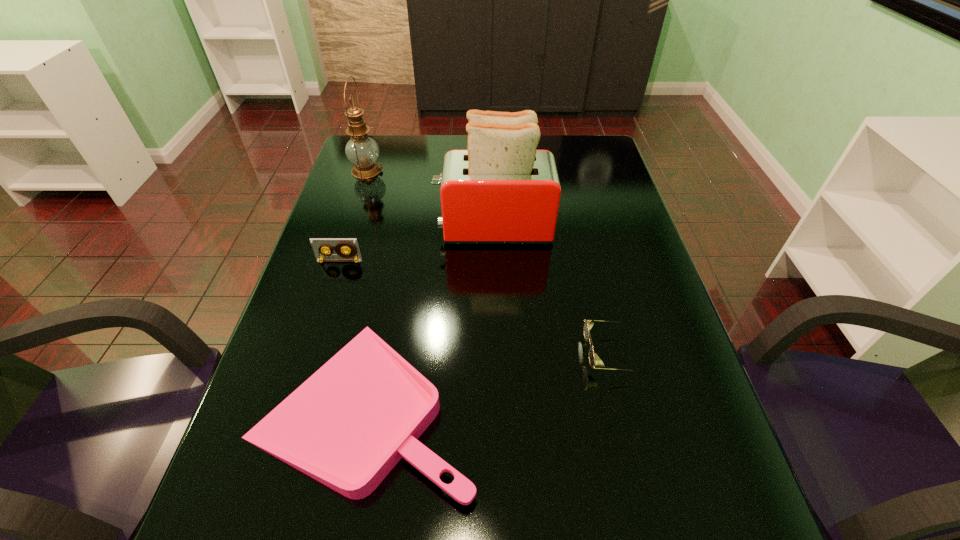
Where is `the fourth nearest object`? The width and height of the screenshot is (960, 540). the fourth nearest object is located at coordinates (501, 190).

Identify the location of oil lamp. (361, 150).

This screenshot has width=960, height=540. I want to click on the third shortest object, so click(319, 245).

Where is `the third nearest object`? This screenshot has width=960, height=540. the third nearest object is located at coordinates (319, 245).

Locate an element on the screen. The width and height of the screenshot is (960, 540). the fourth tallest object is located at coordinates (594, 360).

You are a GUI agent. You are given a task and a screenshot of the screen. Output one action in this format:
    pyautogui.click(x=<x>, y=<y>)
    Task: Click on the sunglasses
    The width and height of the screenshot is (960, 540).
    Given the screenshot: What is the action you would take?
    pyautogui.click(x=594, y=360)

Where is `dustpan`? The width and height of the screenshot is (960, 540). dustpan is located at coordinates (347, 426).

Identify the location of vacant region located 0.090m on the front-facing side of the fourth nearest object. (404, 227).

The image size is (960, 540). I want to click on blank area located 0.050m on the front-facing side of the fourth nearest object, so click(x=419, y=227).

You are a GUI agent. You are given a task and a screenshot of the screen. Output one action in this format:
    pyautogui.click(x=<x>, y=<y>)
    Task: Click on the free space located 0.200m on the front-facing side of the fourth nearest object
    This screenshot has height=540, width=960.
    Given the screenshot: What is the action you would take?
    pyautogui.click(x=365, y=227)